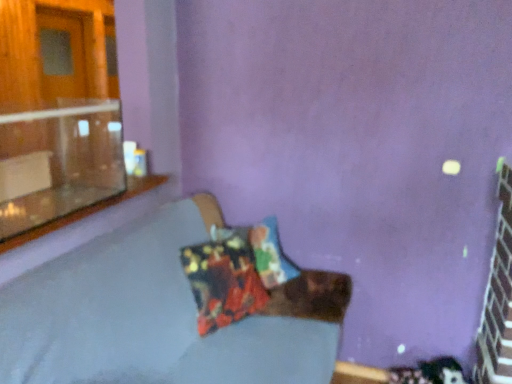
Locate an element on the screen. The width and height of the screenshot is (512, 384). vacant space situated above clear glass window sill at upper left (from a real-world perspective) is located at coordinates (76, 203).